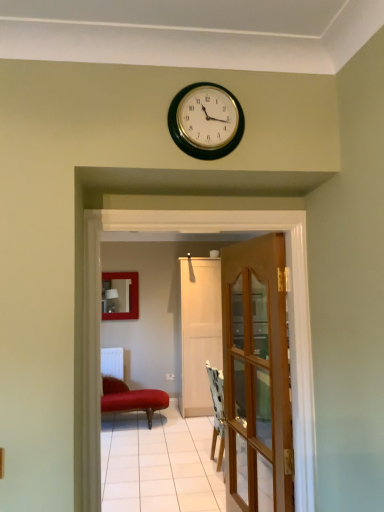
Question: Can you confirm if wooden glass door at center, acting as the 1th door starting from the front, is taller than white matte door at center, the first door viewed from the back?

Choices:
 (A) yes
 (B) no

Answer: (B)

Question: Is the depth of wooden glass door at center, acting as the 1th door starting from the front, greater than that of white matte door at center, the first door viewed from the back?

Choices:
 (A) no
 (B) yes

Answer: (A)

Question: Would you say wooden glass door at center, acting as the 1th door starting from the front, is a long distance from white matte door at center, placed as the 2th door when sorted from front to back?

Choices:
 (A) no
 (B) yes

Answer: (B)

Question: Is wooden glass door at center, acting as the 1th door starting from the front, positioned with its back to white matte door at center, placed as the 2th door when sorted from front to back?

Choices:
 (A) no
 (B) yes

Answer: (A)

Question: Could you tell me if wooden glass door at center, acting as the 1th door starting from the front, is turned towards white matte door at center, the first door viewed from the back?

Choices:
 (A) no
 (B) yes

Answer: (A)

Question: From a real-world perspective, is wooden glass door at center, the 2th door in the back-to-front sequence, on white matte door at center, the first door viewed from the back?

Choices:
 (A) yes
 (B) no

Answer: (A)

Question: From the image's perspective, is metallic gold clock at upper center above white matte door at center, placed as the 2th door when sorted from front to back?

Choices:
 (A) yes
 (B) no

Answer: (A)

Question: Is metallic gold clock at upper center positioned beyond the bounds of white matte door at center, placed as the 2th door when sorted from front to back?

Choices:
 (A) no
 (B) yes

Answer: (B)

Question: Is metallic gold clock at upper center wider than white matte door at center, placed as the 2th door when sorted from front to back?

Choices:
 (A) yes
 (B) no

Answer: (B)

Question: From the image's perspective, is metallic gold clock at upper center below white matte door at center, placed as the 2th door when sorted from front to back?

Choices:
 (A) yes
 (B) no

Answer: (B)

Question: Is metallic gold clock at upper center to the left of white matte door at center, the first door viewed from the back, from the viewer's perspective?

Choices:
 (A) no
 (B) yes

Answer: (B)

Question: Considering the relative sizes of metallic gold clock at upper center and white matte door at center, the first door viewed from the back, in the image provided, is metallic gold clock at upper center taller than white matte door at center, the first door viewed from the back,?

Choices:
 (A) no
 (B) yes

Answer: (A)

Question: From the image's perspective, would you say wooden glass door at center, acting as the 1th door starting from the front, is shown under white glossy door at center?

Choices:
 (A) no
 (B) yes

Answer: (B)